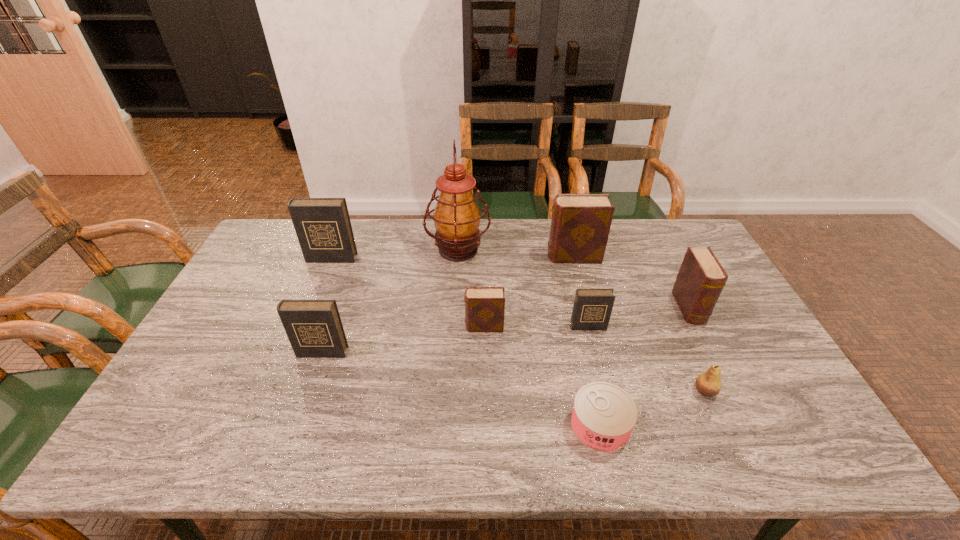
Where is `free space located 0.280m on the front cover of the second smallest dark diary`? The image size is (960, 540). free space located 0.280m on the front cover of the second smallest dark diary is located at coordinates (285, 458).

Locate an element on the screen. The width and height of the screenshot is (960, 540). free spot located 0.230m on the front cover of the rightmost dark diary is located at coordinates (606, 400).

You are a GUI agent. You are given a task and a screenshot of the screen. Output one action in this format:
    pyautogui.click(x=<x>, y=<y>)
    Task: Click on the vacant area located 0.090m on the spine side of the fourth diary from right to left
    
    Given the screenshot: What is the action you would take?
    pyautogui.click(x=434, y=327)

What are the coordinates of `free space located on the spine side of the fourth diary from right to left` in the screenshot? It's located at (423, 327).

This screenshot has height=540, width=960. I want to click on vacant region located on the spine side of the fourth diary from right to left, so click(378, 327).

The image size is (960, 540). I want to click on free space located on the left of the pear, so click(x=582, y=392).

You are a GUI agent. You are given a task and a screenshot of the screen. Output one action in this format:
    pyautogui.click(x=<x>, y=<y>)
    Task: Click on the free space located 0.180m on the left of the shortest object
    The height and width of the screenshot is (540, 960).
    Given the screenshot: What is the action you would take?
    pyautogui.click(x=493, y=426)

Find the location of a particular element. oil lamp at the far edge is located at coordinates (456, 217).

Find the location of `object positioned at the near edge`. object positioned at the near edge is located at coordinates (603, 417).

At what (x,y) coordinates should I click in order to perform the action: click on object at the right edge. Please return your answer as a coordinate pair (x, y). Image resolution: width=960 pixels, height=540 pixels. Looking at the image, I should click on [701, 278].